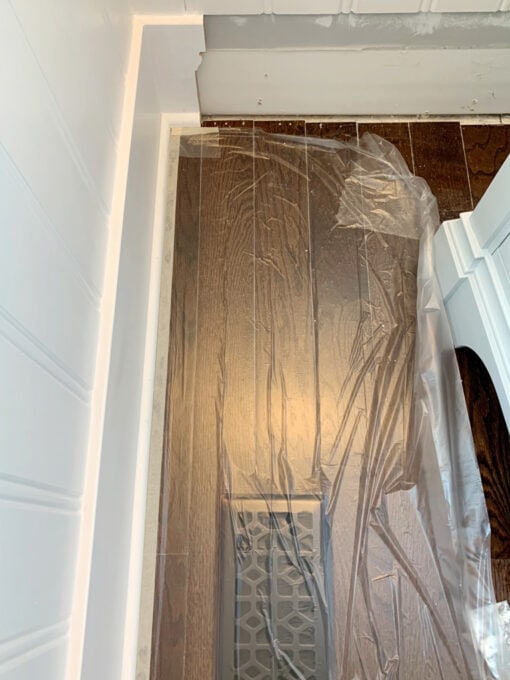
What are the coordinates of `floor` in the screenshot? It's located at (456, 175).